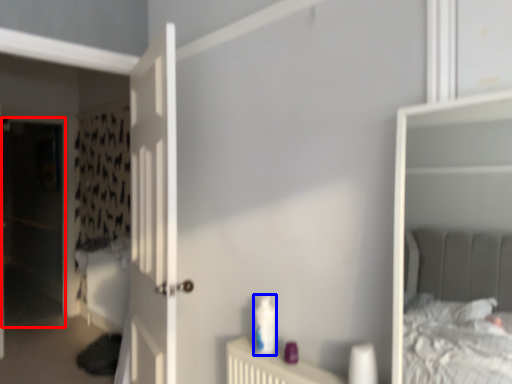
Question: Which object is closer to the camera taking this photo, screen door (highlighted by a red box) or toiletry (highlighted by a blue box)?

Choices:
 (A) screen door
 (B) toiletry

Answer: (B)